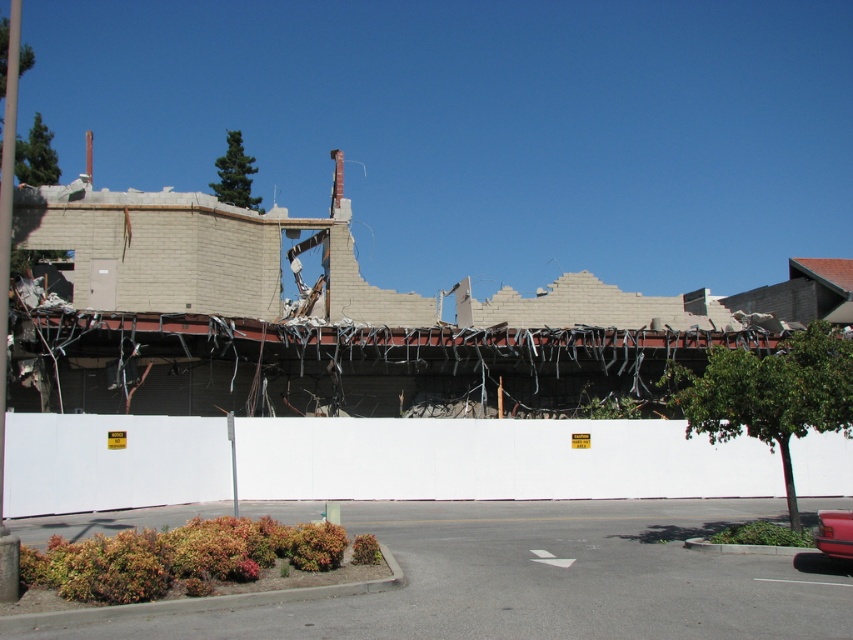
You are a delivery driver approaching the demolished building and need to park your metallic red car at lower right. There is a white plastic fence at center blocking the path. Can you drive around the fence to park your car?

The white plastic fence at center is further to the viewer than metallic red car at lower right, so the fence is closer to you. Since the fence is blocking your path, you cannot drive around it to park your car.

You are a delivery driver who needs to park your metallic red car at lower right as close as possible to the white plastic fence at center without crossing the fence. According to the scene description, what is the minimum distance you can maintain between your car and the fence?

The minimum distance you can maintain between the metallic red car at lower right and the white plastic fence at center is 11.82 meters, as they are already 11.82 meters apart from each other according to the description.